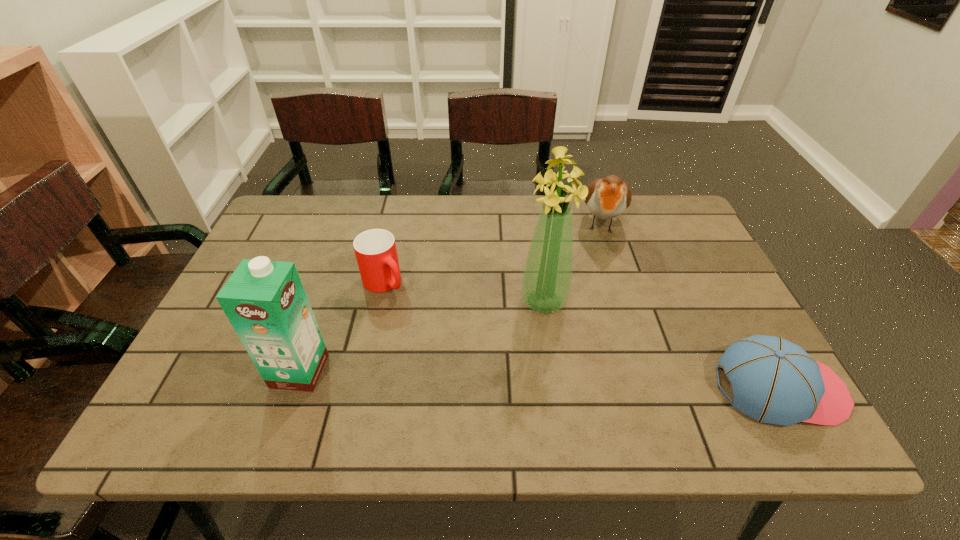
At what (x,y) coordinates should I click in order to perform the action: click on the leftmost object. Please return your answer as a coordinate pair (x, y). Looking at the image, I should click on (265, 301).

Where is `the second tallest object`? The image size is (960, 540). the second tallest object is located at coordinates (265, 301).

The image size is (960, 540). In order to click on baseball cap in this screenshot , I will do `click(773, 380)`.

Locate an element on the screen. bird is located at coordinates (607, 198).

You are a GUI agent. You are given a task and a screenshot of the screen. Output one action in this format:
    pyautogui.click(x=<x>, y=<y>)
    Task: Click on the fourth object from left to right
    
    Given the screenshot: What is the action you would take?
    pyautogui.click(x=607, y=198)

This screenshot has width=960, height=540. Find the location of `bouquet`. bouquet is located at coordinates 547,276.

Identify the location of the third object from right to left. The image size is (960, 540). (547, 276).

Find the location of `the fourth object from right to left`. the fourth object from right to left is located at coordinates (375, 249).

Identify the location of blank space located 0.350m on the right of the carton. The width and height of the screenshot is (960, 540). (482, 370).

Where is `free space located 0.210m at the face of the farthest object`? The image size is (960, 540). free space located 0.210m at the face of the farthest object is located at coordinates (601, 298).